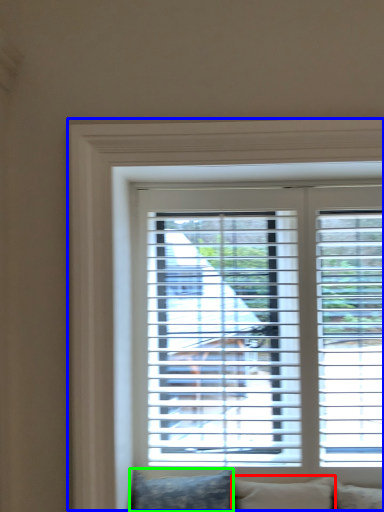
Question: Which object is positioned farthest from pillow (highlighted by a red box)? Select from window (highlighted by a blue box) and pillow (highlighted by a green box).

Choices:
 (A) window
 (B) pillow

Answer: (A)